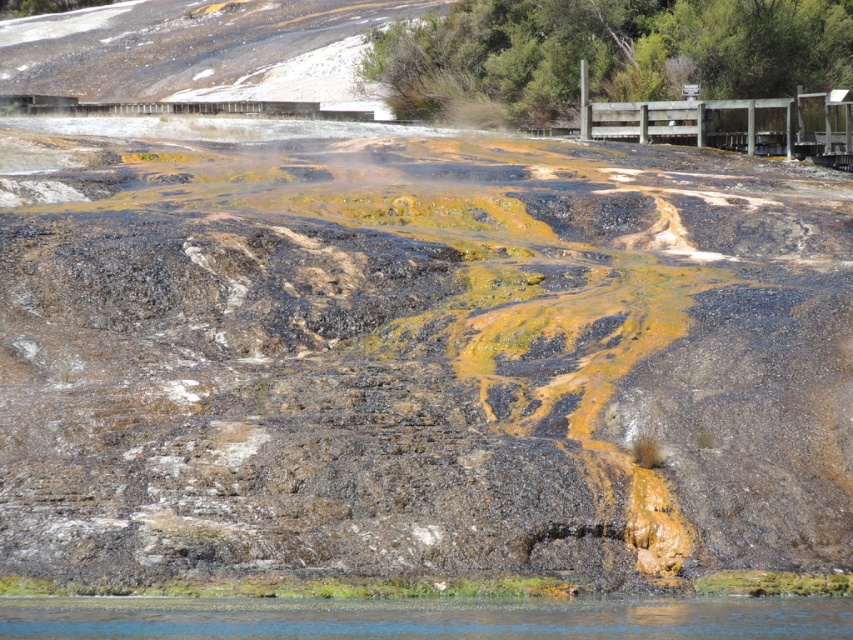
You are a park ranger planning to install a safety barrier along the walkway. The barrier requires a minimum width of 2 meters to be effective. Given the rusty metal bridge at upper left and clear water at lower center, which object has a width that meets this requirement?

The rusty metal bridge at upper left has a greater width than the clear water at lower center, so it likely meets the 2 meter requirement for the safety barrier.